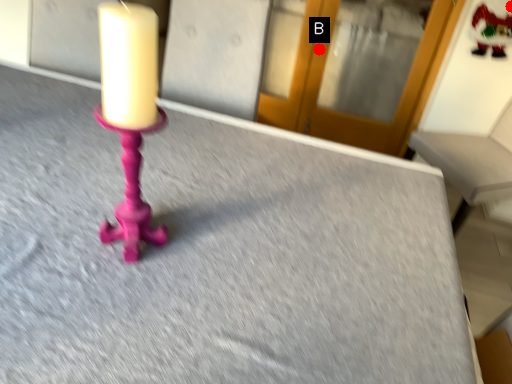
Question: Two points are circled on the image, labeled by A and B beside each circle. Which point is closer to the camera?

Choices:
 (A) A is closer
 (B) B is closer

Answer: (A)